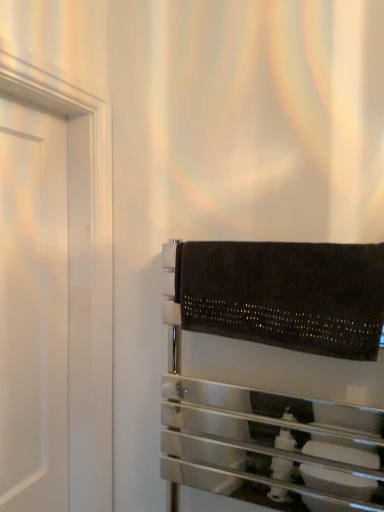
Question: From the image's perspective, is black textured towel rack at right below black suede towel at lower right?

Choices:
 (A) yes
 (B) no

Answer: (A)

Question: From the image's perspective, is black textured towel rack at right above black suede towel at lower right?

Choices:
 (A) yes
 (B) no

Answer: (B)

Question: Is black textured towel rack at right positioned far away from black suede towel at lower right?

Choices:
 (A) yes
 (B) no

Answer: (B)

Question: Does black textured towel rack at right appear on the left side of black suede towel at lower right?

Choices:
 (A) yes
 (B) no

Answer: (A)

Question: Is black textured towel rack at right shorter than black suede towel at lower right?

Choices:
 (A) no
 (B) yes

Answer: (A)

Question: Does black textured towel rack at right have a greater width compared to black suede towel at lower right?

Choices:
 (A) yes
 (B) no

Answer: (A)

Question: From a real-world perspective, is black suede towel at lower right over black textured towel rack at right?

Choices:
 (A) yes
 (B) no

Answer: (A)

Question: Does black suede towel at lower right have a smaller size compared to black textured towel rack at right?

Choices:
 (A) yes
 (B) no

Answer: (A)

Question: Is black suede towel at lower right placed right next to black textured towel rack at right?

Choices:
 (A) yes
 (B) no

Answer: (B)

Question: Does black suede towel at lower right have a greater width compared to black textured towel rack at right?

Choices:
 (A) no
 (B) yes

Answer: (A)

Question: Is black textured towel rack at right located within black suede towel at lower right?

Choices:
 (A) no
 (B) yes

Answer: (A)

Question: From a real-world perspective, is black suede towel at lower right beneath black textured towel rack at right?

Choices:
 (A) no
 (B) yes

Answer: (A)

Question: From a real-world perspective, is black suede towel at lower right positioned above or below black textured towel rack at right?

Choices:
 (A) below
 (B) above

Answer: (B)